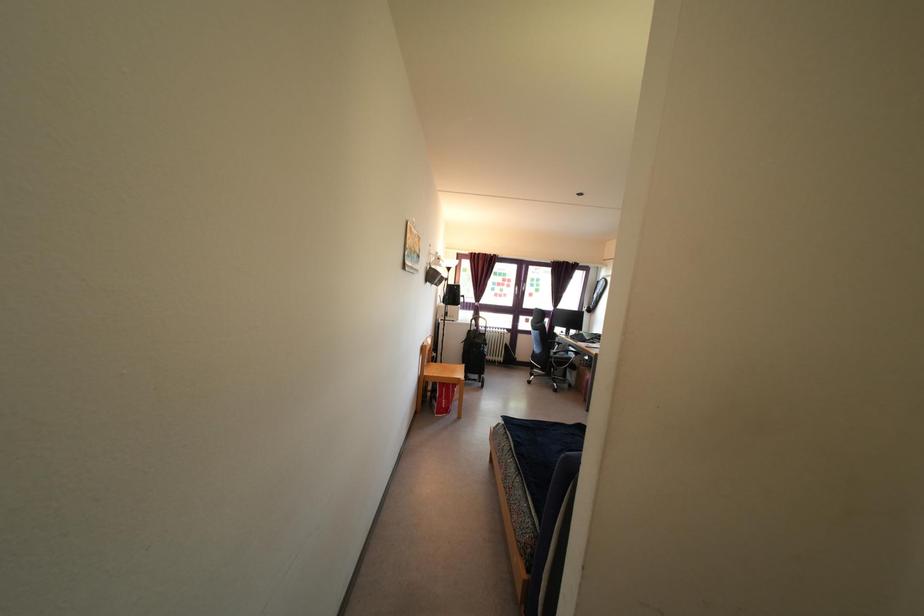
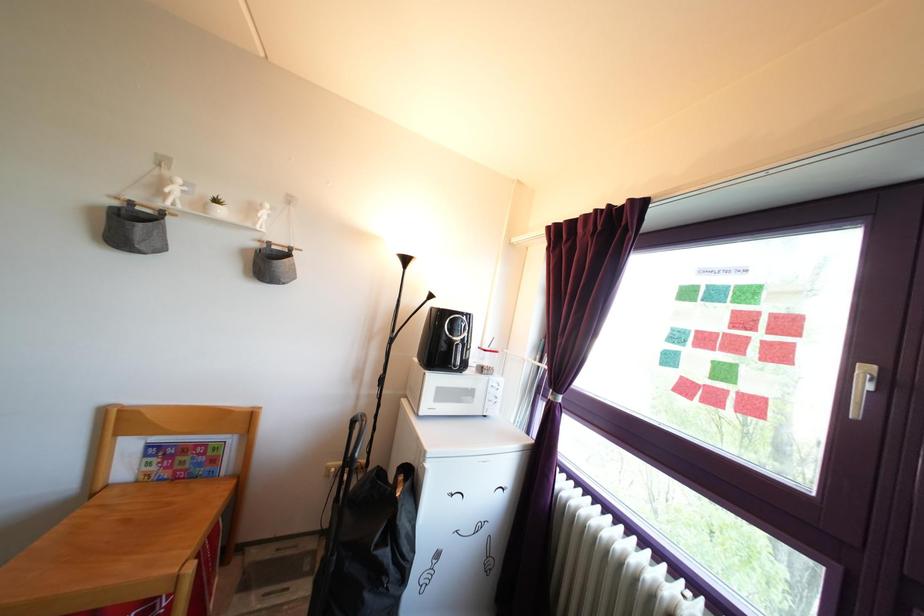
The point at (504,304) is marked in the first image. Where is the corresponding point in the second image?

(715, 407)